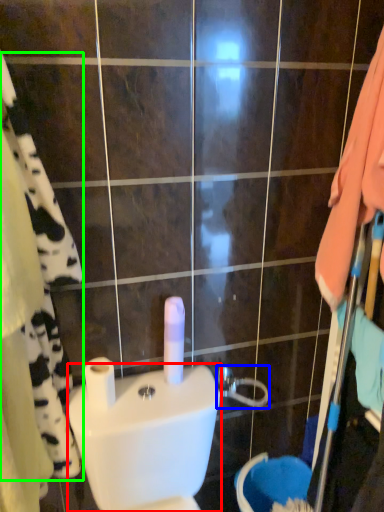
Question: Estimate the real-world distances between objects in this image. Which object is farther from toilet bowl (highlighted by a red box), shower (highlighted by a blue box) or bath towel (highlighted by a green box)?

Choices:
 (A) shower
 (B) bath towel

Answer: (A)